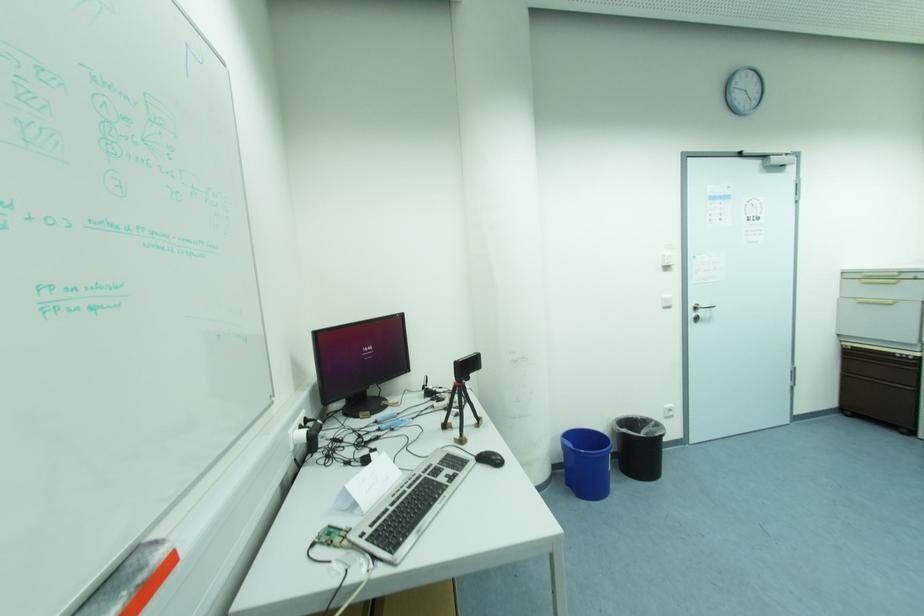
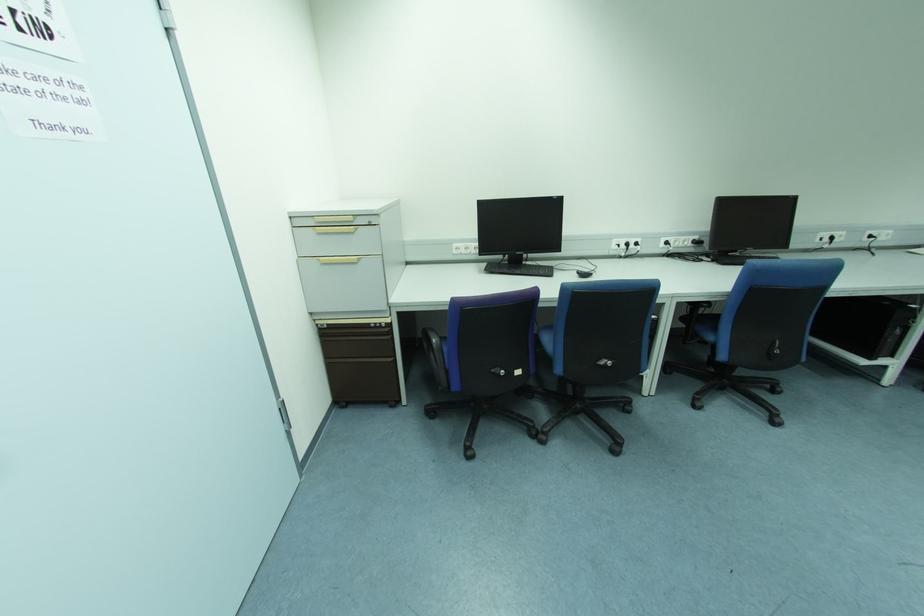
The point at (896, 274) is marked in the first image. Where is the corresponding point in the second image?

(350, 219)